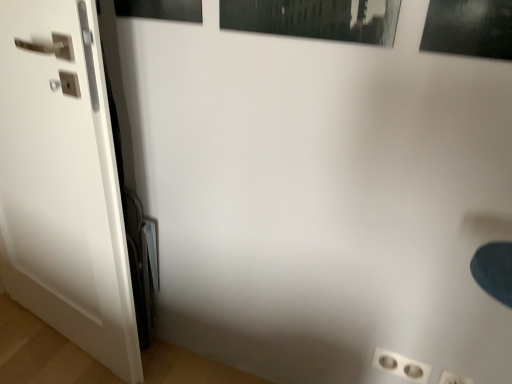
Question: Is white glossy door at left outside of white plastic outlet at lower right?

Choices:
 (A) yes
 (B) no

Answer: (A)

Question: Is white glossy door at left positioned behind white plastic outlet at lower right?

Choices:
 (A) no
 (B) yes

Answer: (A)

Question: Can you confirm if white glossy door at left is wider than white plastic outlet at lower right?

Choices:
 (A) yes
 (B) no

Answer: (A)

Question: From the image's perspective, is white glossy door at left over white plastic outlet at lower right?

Choices:
 (A) no
 (B) yes

Answer: (B)

Question: From a real-world perspective, is white glossy door at left physically above white plastic outlet at lower right?

Choices:
 (A) no
 (B) yes

Answer: (B)

Question: Is white glossy door at left at the left side of white plastic outlet at lower right?

Choices:
 (A) yes
 (B) no

Answer: (A)

Question: Can you confirm if white glossy door at left is bigger than matte black picture frame at upper left?

Choices:
 (A) no
 (B) yes

Answer: (B)

Question: Is the depth of white glossy door at left less than that of matte black picture frame at upper left?

Choices:
 (A) yes
 (B) no

Answer: (A)

Question: Is white glossy door at left beside matte black picture frame at upper left?

Choices:
 (A) no
 (B) yes

Answer: (A)

Question: Is white glossy door at left oriented towards matte black picture frame at upper left?

Choices:
 (A) no
 (B) yes

Answer: (A)

Question: Does white glossy door at left have a lesser height compared to matte black picture frame at upper left?

Choices:
 (A) yes
 (B) no

Answer: (B)

Question: Can you confirm if white glossy door at left is positioned to the right of matte black picture frame at upper left?

Choices:
 (A) no
 (B) yes

Answer: (A)

Question: Can you confirm if white plastic outlet at lower right is bigger than matte black picture frame at upper left?

Choices:
 (A) yes
 (B) no

Answer: (B)